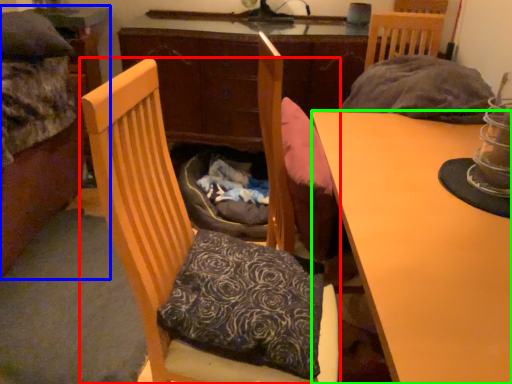
Question: Considering the real-world distances, which object is farthest from chair (highlighted by a red box)? bed (highlighted by a blue box) or desk (highlighted by a green box)?

Choices:
 (A) bed
 (B) desk

Answer: (A)